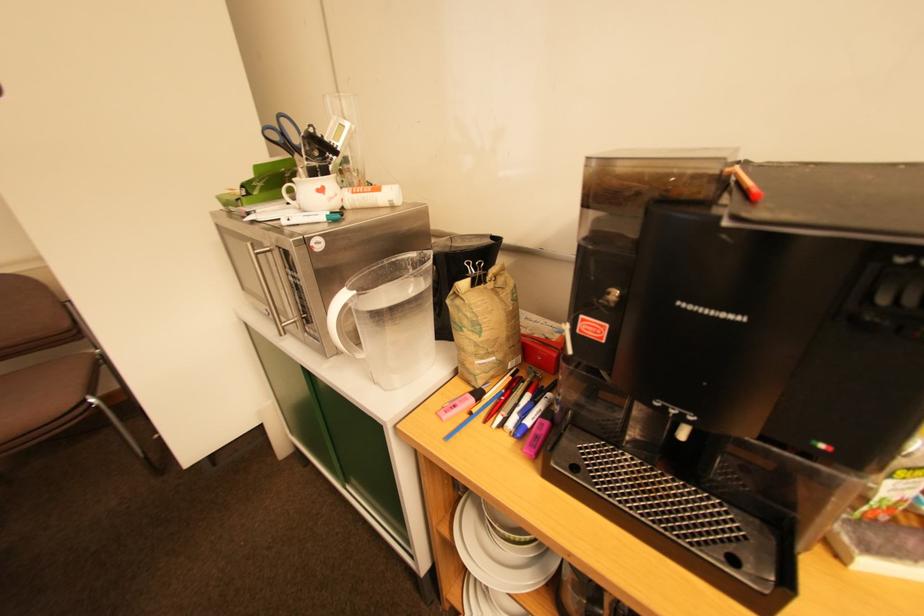
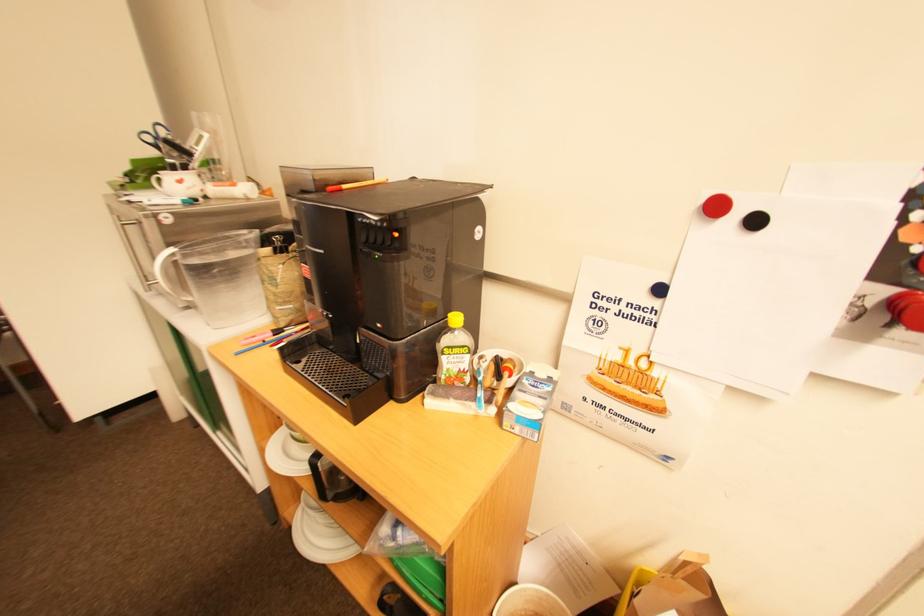
In a continuous first-person perspective shot, in which direction is the camera moving?

The cameraman walked toward right, backward.